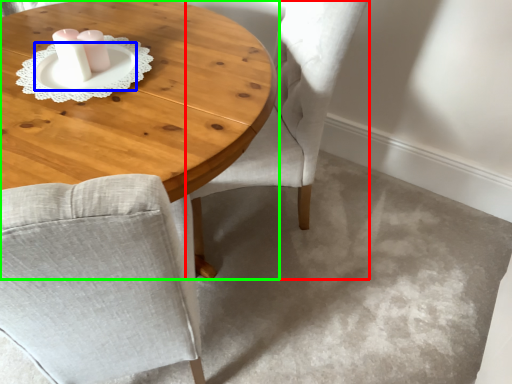
Question: Which object is positioned farthest from chair (highlighted by a red box)? Select from saucer (highlighted by a blue box) and coffee table (highlighted by a green box).

Choices:
 (A) saucer
 (B) coffee table

Answer: (A)